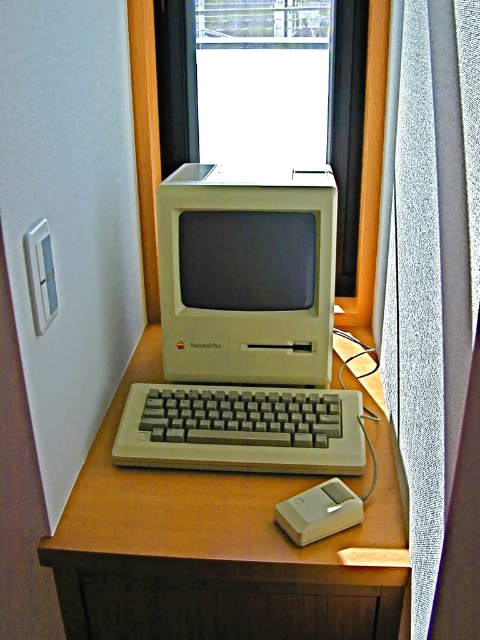
You are a delivery person trying to place a large package on the desk. The package is 1.2 meters wide. The desk has two sections, one made of wooden at center and another with transparent glass window at center. Which section can fit the package?

The wooden at center is larger in size than the transparent glass window at center, so the wooden section can fit the 1.2 meters wide package.

You are standing in front of the desk and want to place a small plant between the wooden at center and the transparent glass window at center. Which object should the plant be closer to if you want it to be near the edge of the desk?

The plant should be placed closer to the transparent glass window at center because the wooden at center is closer to you, so placing it near the window would position it toward the edge of the desk.

You are a delivery person who needs to place a large package on the desk. The desk has a transparent glass window at center and a white plastic computer monitor at center. Which object should you avoid placing the package on to prevent damage to the monitor?

You should avoid placing the package on the white plastic computer monitor at center because the transparent glass window at center is above it, so the monitor is likely positioned lower and directly on the desk surface where the package would be placed.